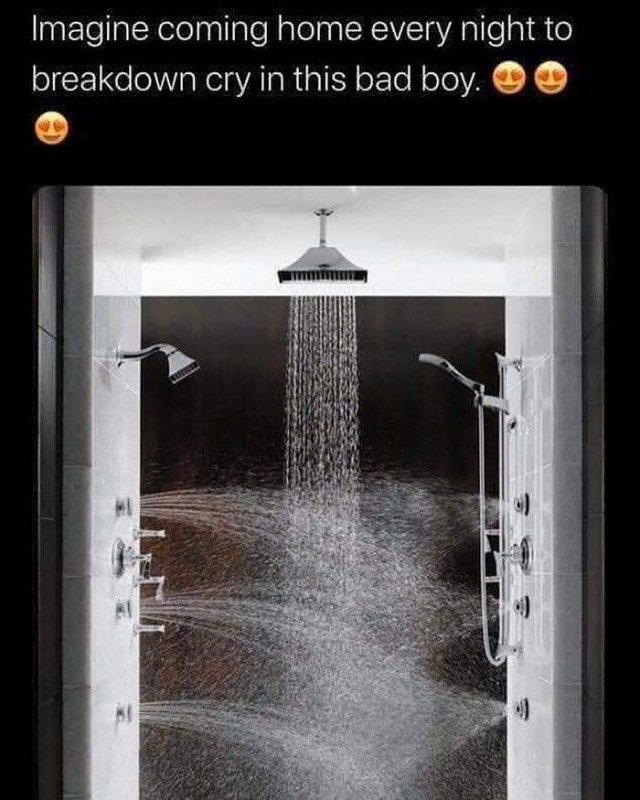
Where is `white shower tiles`? This screenshot has width=640, height=800. white shower tiles is located at coordinates (115, 310), (532, 293).